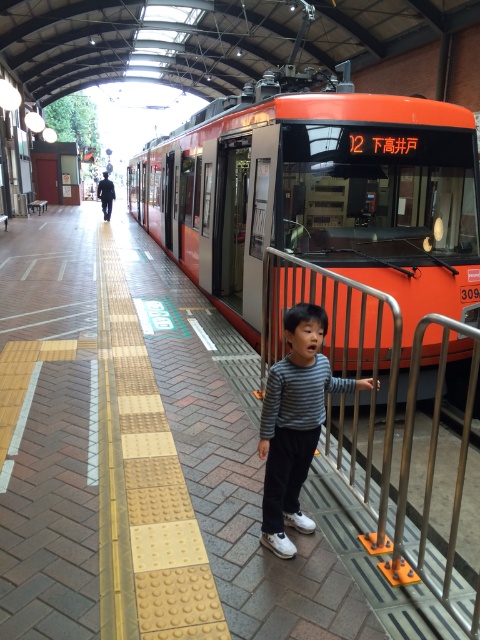
You are standing at the tram station and want to take a photo of the two points mentioned. Which point, point (x=447, y=548) or point (x=307, y=353), will appear larger in your photo?

Point (x=447, y=548) will appear larger in the photo because it is closer to the camera than point (x=307, y=353).

You are a parent waiting at the tram station. Your child is near the edge of the platform. You need to ensure the child is safe. Based on the scene, which object is a better reference point to keep the child close to, the silver metallic rail at center or the striped fabric child at center?

The striped fabric child at center is the better reference point because the silver metallic rail at center is much taller and might be harder for the child to stay close to safely.

You are a tram conductor preparing to board the tram. You need to locate the silver metallic rail at center to ensure the tram is properly aligned. Based on the coordinates provided, where exactly should you look on the platform to find this rail?

The silver metallic rail at center is located at coordinates point (x=388, y=426), so you should look towards the lower right section of the platform to find it.